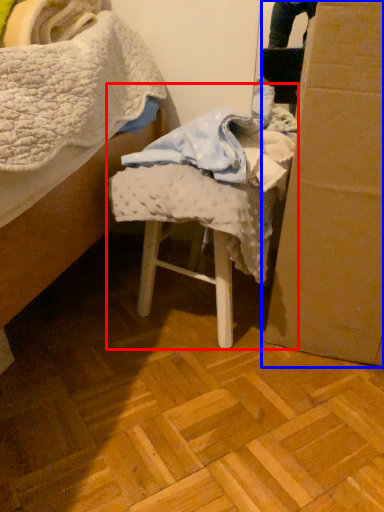
Question: Among these objects, which one is nearest to the camera, chair (highlighted by a red box) or cardboard box (highlighted by a blue box)?

Choices:
 (A) chair
 (B) cardboard box

Answer: (B)